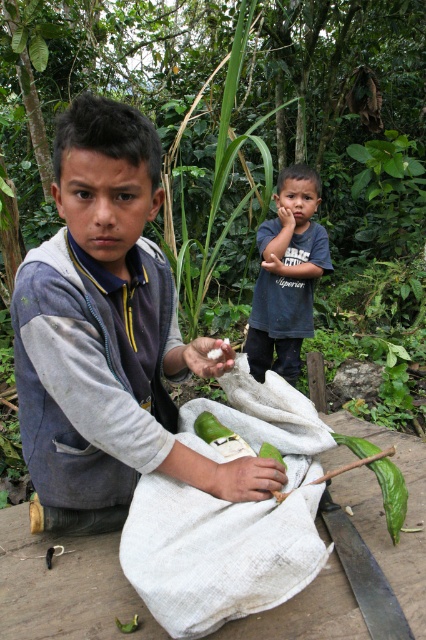
Is white woven cloth at center to the left of dark blue t-shirt at upper center from the viewer's perspective?

Yes, white woven cloth at center is to the left of dark blue t-shirt at upper center.

Between white woven cloth at center and dark blue t-shirt at upper center, which one is positioned higher?

Positioned higher is dark blue t-shirt at upper center.

The image size is (426, 640). Identify the location of white woven cloth at center. (230, 516).

Between gray fleece jacket at left and white woven cloth at center, which one has more height?

gray fleece jacket at left

What are the coordinates of `gray fleece jacket at left` in the screenshot? It's located at (108, 337).

Does gray fleece jacket at left have a lesser width compared to dark blue t-shirt at upper center?

No, gray fleece jacket at left is not thinner than dark blue t-shirt at upper center.

I want to click on gray fleece jacket at left, so click(x=108, y=337).

Find the location of a particular element. The width and height of the screenshot is (426, 640). gray fleece jacket at left is located at coordinates (108, 337).